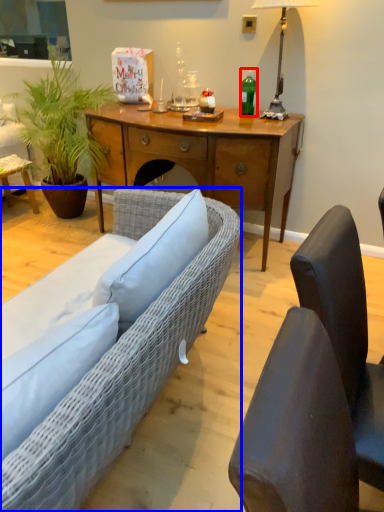
Question: Which object appears closest to the camera in this image, bottle (highlighted by a red box) or studio couch (highlighted by a blue box)?

Choices:
 (A) bottle
 (B) studio couch

Answer: (B)